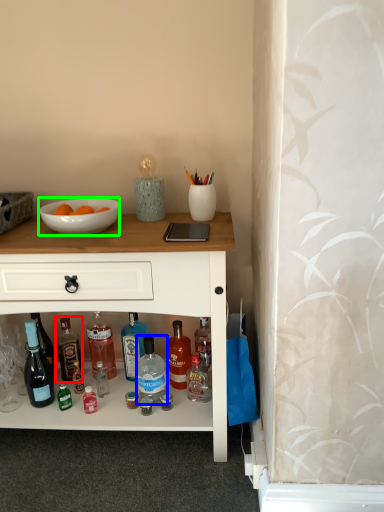
Question: Which is farther away from bottle (highlighted by a red box)? bottle (highlighted by a blue box) or bowl (highlighted by a green box)?

Choices:
 (A) bottle
 (B) bowl

Answer: (B)